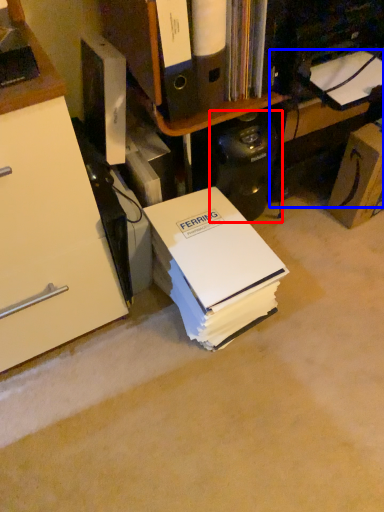
Question: Which object is closer to the camera taking this photo, computer tower (highlighted by a red box) or computer desk (highlighted by a blue box)?

Choices:
 (A) computer tower
 (B) computer desk

Answer: (A)